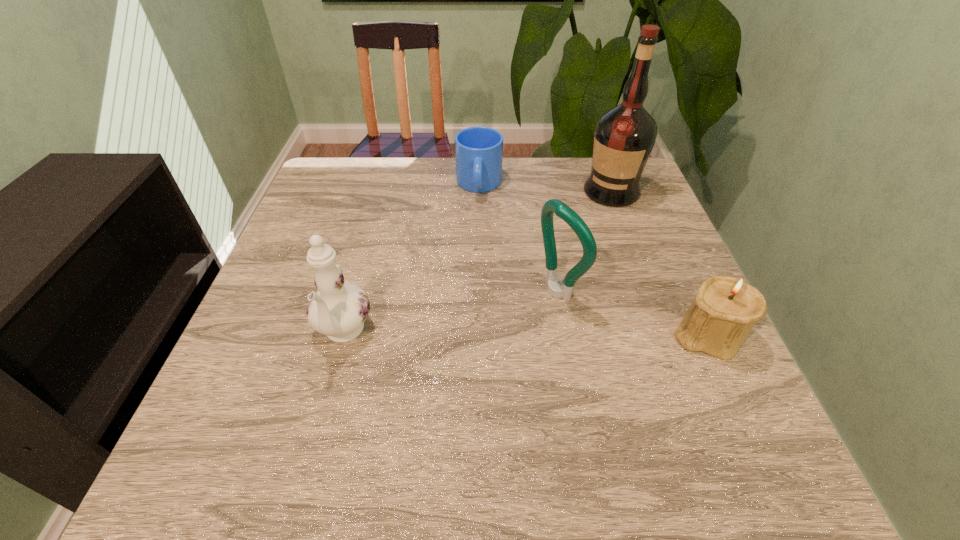
I want to click on free location located on the side of the second object from left to right with the handle, so click(477, 285).

Image resolution: width=960 pixels, height=540 pixels. Find the location of `blank space located 0.120m on the side of the second object from left to right with the handle`. blank space located 0.120m on the side of the second object from left to right with the handle is located at coordinates (478, 232).

Locate an element on the screen. This screenshot has width=960, height=540. vacant region located 0.240m on the side of the second object from left to right with the handle is located at coordinates (477, 266).

Find the location of a particular element. vacant space located at the jaws of the third object from right to left is located at coordinates (396, 375).

Find the location of `free point located at the jaws of the third object from right to left`. free point located at the jaws of the third object from right to left is located at coordinates (514, 316).

Locate an element on the screen. The width and height of the screenshot is (960, 540). vacant space located at the jaws of the third object from right to left is located at coordinates (381, 383).

This screenshot has height=540, width=960. Find the location of `liquor that is at the far edge`. liquor that is at the far edge is located at coordinates (624, 136).

Where is `mug that is positioned at the far edge`? mug that is positioned at the far edge is located at coordinates (478, 150).

Where is `object present at the left edge`? object present at the left edge is located at coordinates (338, 310).

I want to click on candle_holder that is at the right edge, so click(x=726, y=308).